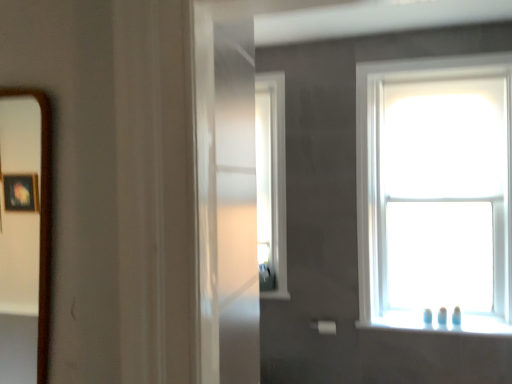
Question: Is clear glass window at center, which ranks as the first window in left-to-right order, facing away from brown wooden mirror at left?

Choices:
 (A) yes
 (B) no

Answer: (B)

Question: Can you confirm if clear glass window at center, which ranks as the first window in left-to-right order, is wider than brown wooden mirror at left?

Choices:
 (A) yes
 (B) no

Answer: (A)

Question: Is clear glass window at center, which ranks as the first window in left-to-right order, positioned before brown wooden mirror at left?

Choices:
 (A) no
 (B) yes

Answer: (A)

Question: Does clear glass window at center, arranged as the 2th window when viewed from the right, have a greater height compared to brown wooden mirror at left?

Choices:
 (A) yes
 (B) no

Answer: (A)

Question: Does clear glass window at center, arranged as the 2th window when viewed from the right, have a lesser height compared to brown wooden mirror at left?

Choices:
 (A) no
 (B) yes

Answer: (A)

Question: From the image's perspective, is white glossy window sill at lower right above or below brown wooden mirror at left?

Choices:
 (A) below
 (B) above

Answer: (A)

Question: Is white glossy window sill at lower right situated inside brown wooden mirror at left or outside?

Choices:
 (A) outside
 (B) inside

Answer: (A)

Question: Is point (501, 327) closer or farther from the camera than point (30, 124)?

Choices:
 (A) closer
 (B) farther

Answer: (A)

Question: In terms of height, does white glossy window sill at lower right look taller or shorter compared to brown wooden mirror at left?

Choices:
 (A) short
 (B) tall

Answer: (A)

Question: Considering their positions, is white matte towel bar at lower right located in front of or behind clear glass window at center, which ranks as the first window in left-to-right order?

Choices:
 (A) behind
 (B) front

Answer: (B)

Question: Is white matte towel bar at lower right wider or thinner than clear glass window at center, which ranks as the first window in left-to-right order?

Choices:
 (A) wide
 (B) thin

Answer: (B)

Question: Would you say white matte towel bar at lower right is inside or outside clear glass window at center, arranged as the 2th window when viewed from the right?

Choices:
 (A) inside
 (B) outside

Answer: (B)

Question: Based on their sizes in the image, would you say white matte towel bar at lower right is bigger or smaller than clear glass window at center, arranged as the 2th window when viewed from the right?

Choices:
 (A) big
 (B) small

Answer: (B)

Question: Looking at their shapes, would you say white matte towel bar at lower right is wider or thinner than white glossy window sill at lower right?

Choices:
 (A) thin
 (B) wide

Answer: (A)

Question: Does point (311, 326) appear closer or farther from the camera than point (490, 329)?

Choices:
 (A) closer
 (B) farther

Answer: (B)